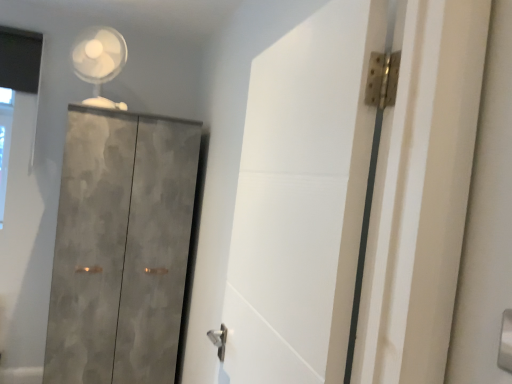
Question: Does white matte door at center have a smaller size compared to white plastic fan at upper left?

Choices:
 (A) no
 (B) yes

Answer: (A)

Question: From the image's perspective, is white matte door at center under white plastic fan at upper left?

Choices:
 (A) yes
 (B) no

Answer: (A)

Question: Are white matte door at center and white plastic fan at upper left far apart?

Choices:
 (A) yes
 (B) no

Answer: (A)

Question: Is white matte door at center bigger than white plastic fan at upper left?

Choices:
 (A) no
 (B) yes

Answer: (B)

Question: From a real-world perspective, does white matte door at center stand above white plastic fan at upper left?

Choices:
 (A) yes
 (B) no

Answer: (B)

Question: Is white matte door at center not inside white plastic fan at upper left?

Choices:
 (A) yes
 (B) no

Answer: (A)

Question: Does white matte door at center appear on the right side of textured concrete cupboard at left?

Choices:
 (A) no
 (B) yes

Answer: (B)

Question: Considering the relative sizes of white matte door at center and textured concrete cupboard at left in the image provided, is white matte door at center wider than textured concrete cupboard at left?

Choices:
 (A) no
 (B) yes

Answer: (A)

Question: Is the surface of white matte door at center in direct contact with textured concrete cupboard at left?

Choices:
 (A) yes
 (B) no

Answer: (B)

Question: Is white matte door at center not near textured concrete cupboard at left?

Choices:
 (A) no
 (B) yes

Answer: (B)

Question: From a real-world perspective, is white matte door at center located beneath textured concrete cupboard at left?

Choices:
 (A) no
 (B) yes

Answer: (A)

Question: From the image's perspective, is white matte door at center on textured concrete cupboard at left?

Choices:
 (A) yes
 (B) no

Answer: (A)

Question: Can you confirm if textured concrete cupboard at left is taller than white plastic fan at upper left?

Choices:
 (A) yes
 (B) no

Answer: (A)